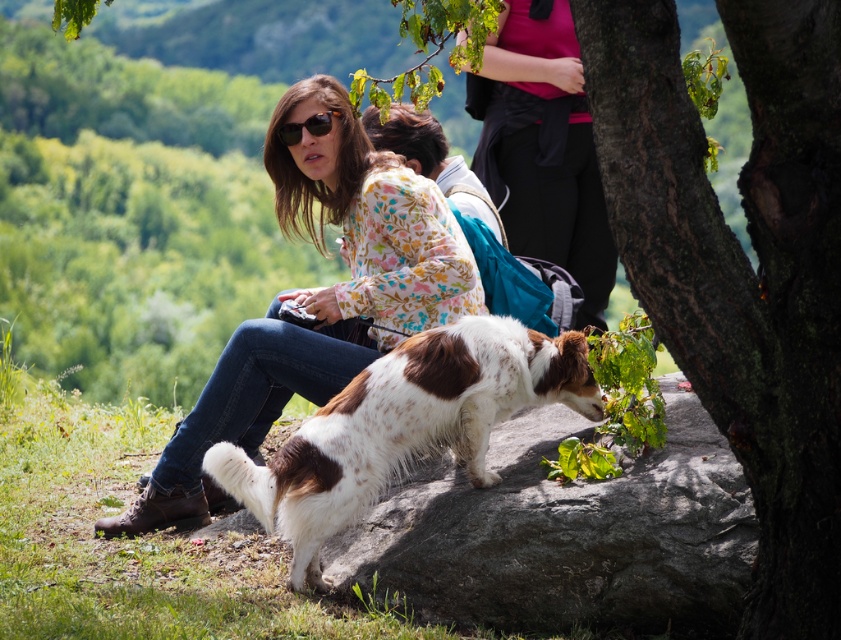
Can you confirm if smooth gray rock at center is positioned to the right of matte black sunglasses at upper center?

Correct, you'll find smooth gray rock at center to the right of matte black sunglasses at upper center.

Which is more to the left, smooth gray rock at center or matte black sunglasses at upper center?

From the viewer's perspective, matte black sunglasses at upper center appears more on the left side.

Image resolution: width=841 pixels, height=640 pixels. Find the location of `smooth gray rock at center`. smooth gray rock at center is located at coordinates (566, 532).

Locate an element on the screen. Image resolution: width=841 pixels, height=640 pixels. smooth gray rock at center is located at coordinates (566, 532).

Can you confirm if smooth gray rock at center is thinner than matte pink shirt at upper center?

Incorrect, smooth gray rock at center's width is not less than matte pink shirt at upper center's.

Is smooth gray rock at center shorter than matte pink shirt at upper center?

Yes.

Measure the distance between point (400, 493) and camera.

Point (400, 493) and camera are 17.73 feet apart.

At what (x,y) coordinates should I click in order to perform the action: click on smooth gray rock at center. Please return your answer as a coordinate pair (x, y). Image resolution: width=841 pixels, height=640 pixels. Looking at the image, I should click on (566, 532).

How distant is brown and white fur dog at center from matte black sunglasses at upper center?

brown and white fur dog at center is 1.36 meters away from matte black sunglasses at upper center.

Who is more forward, (315, 529) or (331, 116)?

Point (315, 529)

What are the coordinates of `brown and white fur dog at center` in the screenshot? It's located at (403, 426).